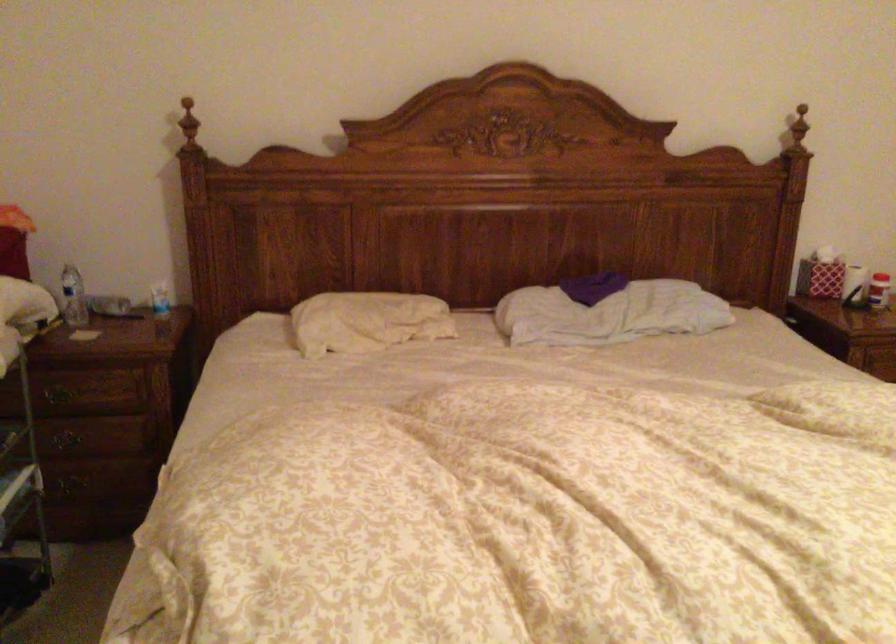
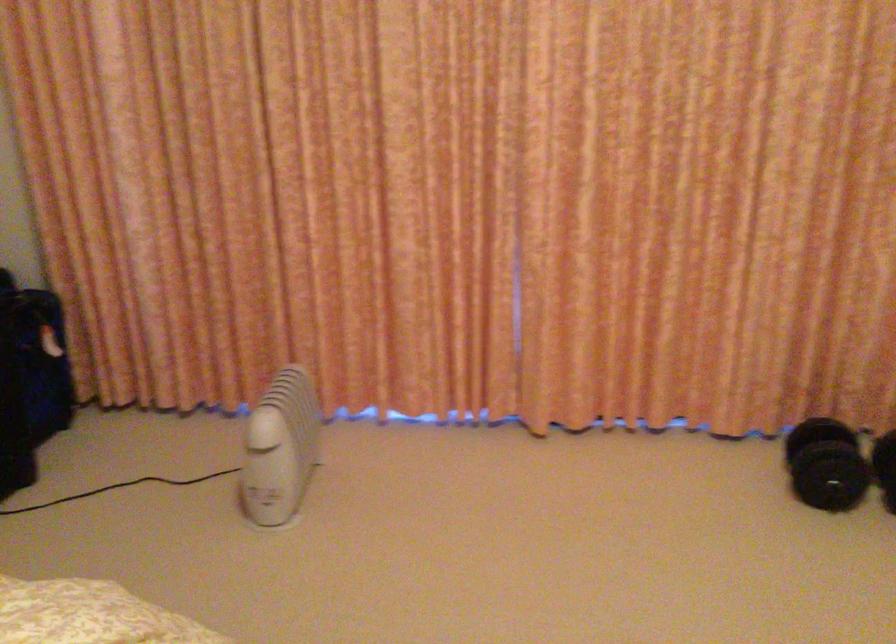
Question: The first image is from the beginning of the video and the second image is from the end. How did the camera likely rotate when shooting the video?

Choices:
 (A) Left
 (B) Right
 (C) Up
 (D) Down

Answer: (B)